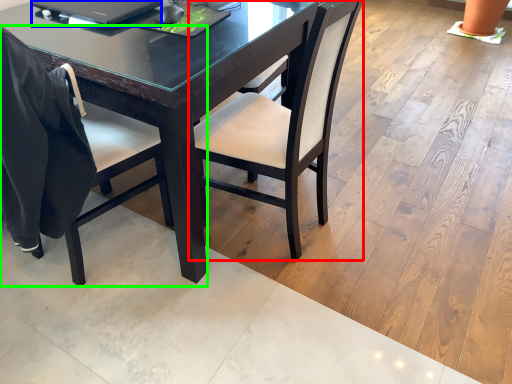
Question: Estimate the real-world distances between objects in this image. Which object is closer to chair (highlighted by a red box), laptop (highlighted by a blue box) or chair (highlighted by a green box)?

Choices:
 (A) laptop
 (B) chair

Answer: (B)